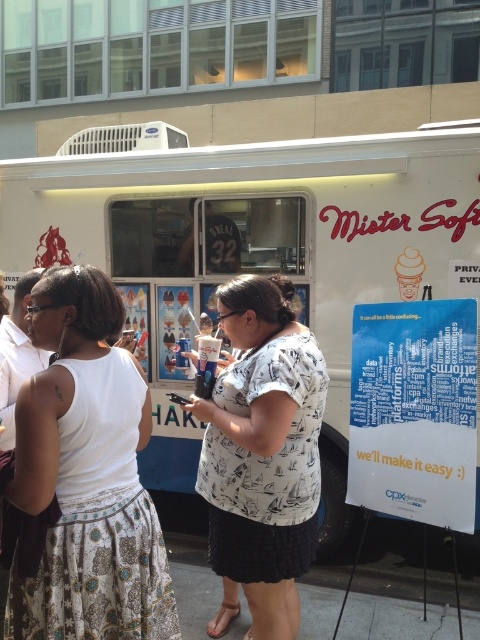
Does point (348, 168) come farther from viewer compared to point (239, 404)?

That is True.

Which is in front, point (420, 129) or point (319, 420)?

Positioned in front is point (319, 420).

The height and width of the screenshot is (640, 480). I want to click on white matte food truck at center, so click(x=255, y=250).

At what (x,y) coordinates should I click in order to perform the action: click on white matte food truck at center. Please return your answer as a coordinate pair (x, y). The image size is (480, 640). Looking at the image, I should click on (255, 250).

Does white matte food truck at center have a greater width compared to white printed blouse at center?

Correct, the width of white matte food truck at center exceeds that of white printed blouse at center.

Who is more forward, (478, 141) or (98, 289)?

Point (98, 289) is in front.

Between point (428, 224) and point (31, 589), which one is positioned behind?

The point (428, 224) is more distant.

Locate an element on the screen. The image size is (480, 640). white matte food truck at center is located at coordinates (255, 250).

Is white printed blouse at center closer to the viewer compared to white printed shirt at center?

Yes, it is.

Can you confirm if white printed blouse at center is positioned to the left of white printed shirt at center?

Correct, you'll find white printed blouse at center to the left of white printed shirt at center.

Does point (36, 476) lie behind point (249, 428)?

That is False.

The width and height of the screenshot is (480, 640). In order to click on white printed blouse at center in this screenshot , I will do `click(84, 477)`.